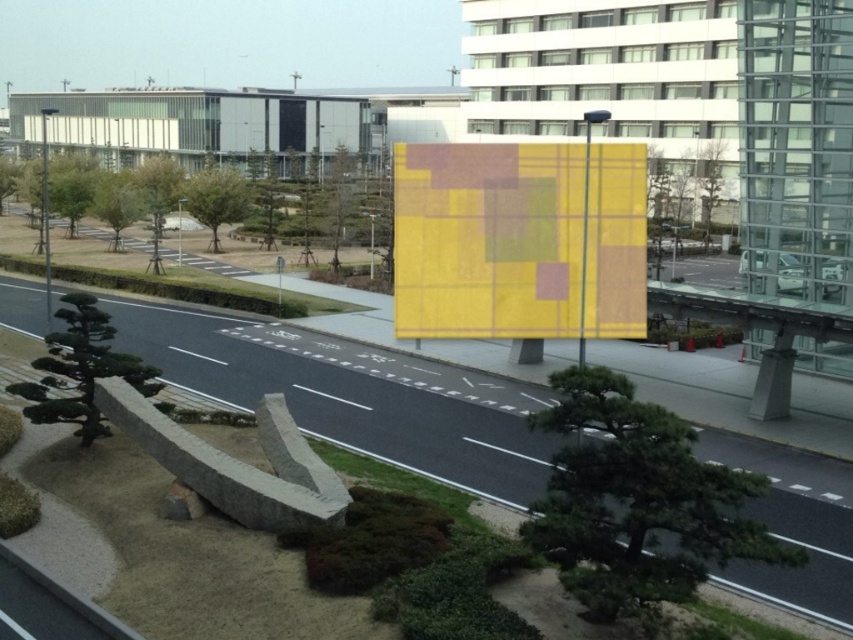
You are standing at the center of the multi lane road in the urban scene. You see two points marked on the ground ahead of you. One is at point [368,432] and the other is at point [521,323]. Which point is closer to your current position?

Point [368,432] is closer to the camera than point [521,323], so it is closer to your current position.

You are a pedestrian standing at the edge of the smooth asphalt highway at center. You see the yellow plaid fabric at center in the distance. Which object is closer to you?

The smooth asphalt highway at center is closer to you because it is in front of the yellow plaid fabric at center.

You are a pedestrian standing at the edge of the smooth asphalt highway at center and the yellow plaid fabric at center. Which object is closer to your left side?

The smooth asphalt highway at center is positioned on the left side of yellow plaid fabric at center, so from your perspective as a pedestrian standing at the edge between them, the smooth asphalt highway at center would be closer to your left side.